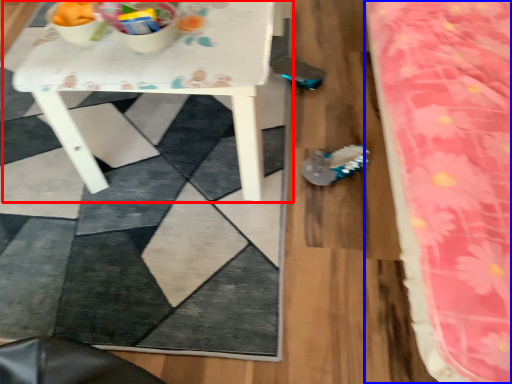
Question: Which object appears farthest to the camera in this image, table (highlighted by a red box) or bed (highlighted by a blue box)?

Choices:
 (A) table
 (B) bed

Answer: (A)